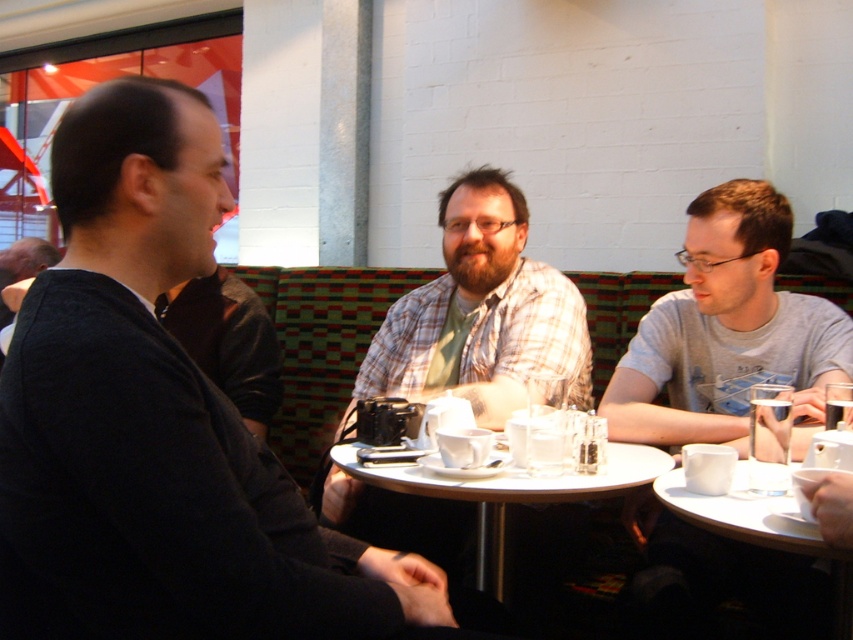
Looking at this image, you are a photographer at the event and need to capture a photo of the gray cotton shirt at right and the clear glass cup at lower right. Which object should you focus on first if you want to ensure both are in focus without adjusting the camera settings?

The gray cotton shirt at right is further to the viewer than the clear glass cup at lower right, so you should focus on the gray cotton shirt at right first to ensure both are in focus.

You are a photographer at the event and need to place a new camera on the table. The camera requires a space larger than the gray cotton shirt at right. Can you place it next to the clear glass cup at lower right?

The gray cotton shirt at right is larger in size than the clear glass cup at lower right. Since the camera needs a space larger than the gray cotton shirt at right, it cannot be placed next to the clear glass cup at lower right as there is insufficient space.

You are taking a photo of the group and want to focus on both the point at (650, 461) and the point at (775, 547). Which point is closer to the camera?

Point (775, 547) is closer to the camera than point (650, 461).